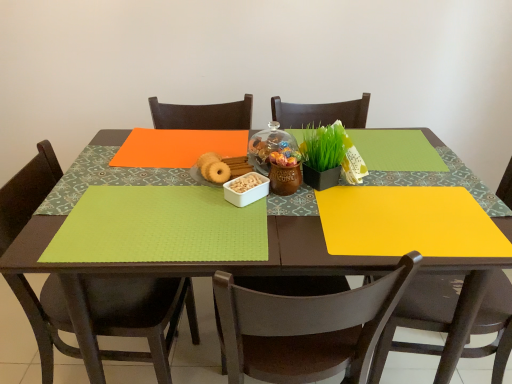
Question: Can you confirm if matte wood table at center is taller than matte brown chair at lower right, placed as the 3th chair when sorted from left to right?

Choices:
 (A) no
 (B) yes

Answer: (A)

Question: Is matte wood table at center thinner than matte brown chair at lower right, placed as the 3th chair when sorted from left to right?

Choices:
 (A) no
 (B) yes

Answer: (A)

Question: Is matte wood table at center oriented towards matte brown chair at lower right, placed as the 3th chair when sorted from left to right?

Choices:
 (A) yes
 (B) no

Answer: (B)

Question: Would you say matte wood table at center is a long distance from matte brown chair at lower right, positioned as the 1th chair in right-to-left order?

Choices:
 (A) no
 (B) yes

Answer: (A)

Question: Is matte wood table at center facing away from matte brown chair at lower right, placed as the 3th chair when sorted from left to right?

Choices:
 (A) no
 (B) yes

Answer: (A)

Question: Is matte wood table at center located outside matte brown chair at lower right, positioned as the 1th chair in right-to-left order?

Choices:
 (A) yes
 (B) no

Answer: (A)

Question: Can you confirm if brown wooden chair at center, positioned as the second chair in right-to-left order, is positioned to the left of matte wood table at center?

Choices:
 (A) no
 (B) yes

Answer: (A)

Question: Does brown wooden chair at center, which is counted as the 2th chair, starting from the left, have a greater height compared to matte wood table at center?

Choices:
 (A) no
 (B) yes

Answer: (B)

Question: Is brown wooden chair at center, positioned as the second chair in right-to-left order, further to the viewer compared to matte wood table at center?

Choices:
 (A) yes
 (B) no

Answer: (B)

Question: Is brown wooden chair at center, positioned as the second chair in right-to-left order, surrounding matte wood table at center?

Choices:
 (A) no
 (B) yes

Answer: (A)

Question: From a real-world perspective, is brown wooden chair at center, positioned as the second chair in right-to-left order, beneath matte wood table at center?

Choices:
 (A) no
 (B) yes

Answer: (A)

Question: Is brown wooden chair at center, which is counted as the 2th chair, starting from the left, closer to camera compared to matte wood table at center?

Choices:
 (A) yes
 (B) no

Answer: (A)

Question: Is lime green fabric placemat at lower left to the left of transparent glass jar at center from the viewer's perspective?

Choices:
 (A) yes
 (B) no

Answer: (A)